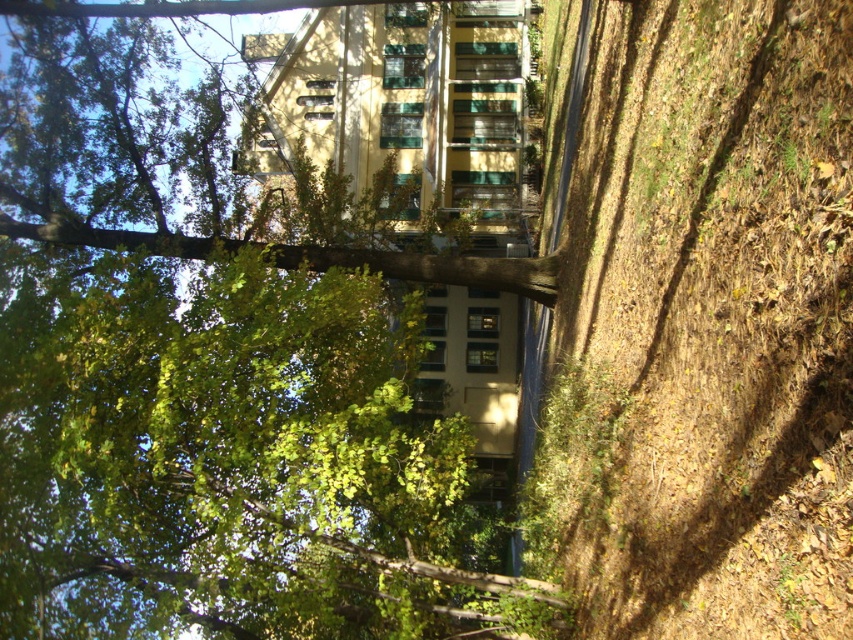
Can you confirm if green leafy tree at center is positioned below brown dirt at lower right?

Indeed, green leafy tree at center is positioned under brown dirt at lower right.

Who is more distant from viewer, (265, 449) or (614, 621)?

Positioned behind is point (265, 449).

Find the location of `green leafy tree at center`. green leafy tree at center is located at coordinates (202, 372).